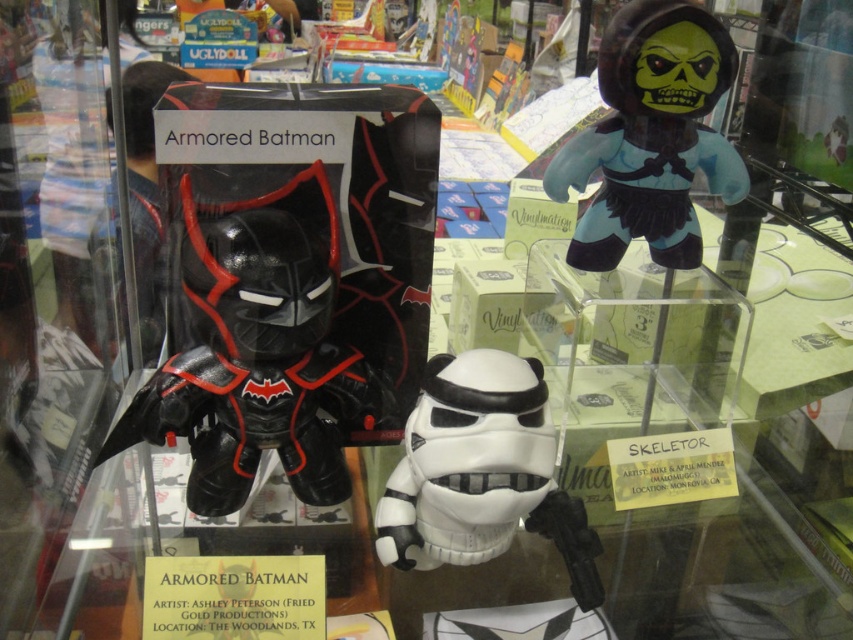
You are a collector who wants to arrange these two figures in a shelf. The shelf has a height limit of 30 cm. You have the matte black vinyl figure at center and the matte black figure at upper right. Which one can you place on the shelf without exceeding the height limit?

The matte black figure at upper right is shorter than the matte black vinyl figure at center. Since the shelf has a 30 cm height limit, you should place the matte black figure at upper right to ensure it doesn not exceed the height limit.